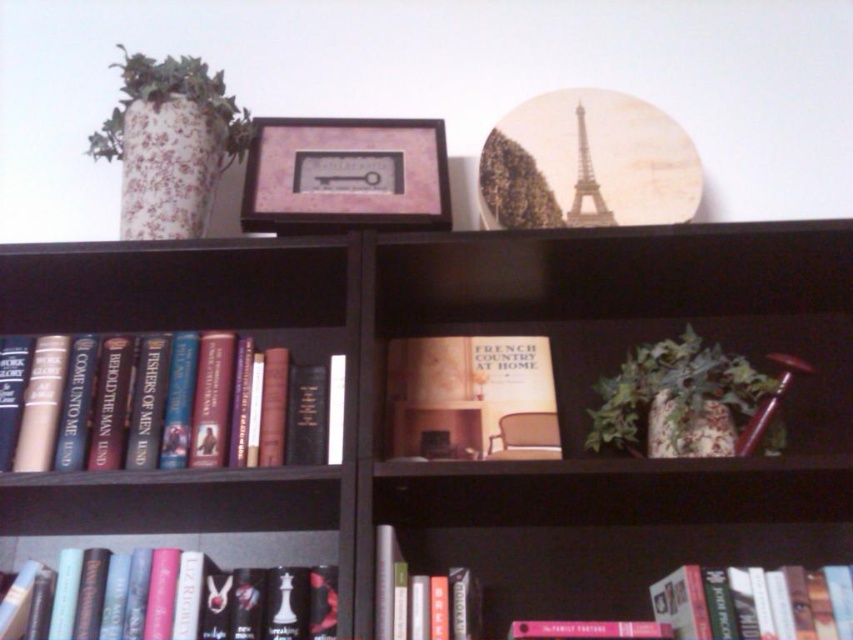
In the scene shown: You are standing in front of the bookshelf and want to place a new book between the two points marked as point (519, 410) and point (692, 397). Since the book is 10 cm thick, will it fit between them?

Point (519, 410) is closer to you than point (692, 397). The distance between them is not specified, but since the book is 10 cm thick, you should measure the space between them to ensure it can accommodate the book.

In the scene shown: You are standing in front of a dark wooden bookshelf filled with books and decorative items. There is a point marked at coordinate (483, 460). What object is located at this coordinate?

The point at coordinate (483, 460) marks the brown wooden bookcase at center.

Consider the image. You are organizing a bookshelf and need to place a new book that is 15 cm wide. You see the matte hardcover book at center and the green leafy plant at upper right. Which object has a width that allows the new book to fit next to it?

The matte hardcover book at center has a width less than the green leafy plant at upper right, so the new book can fit next to the matte hardcover book at center since it is narrower.